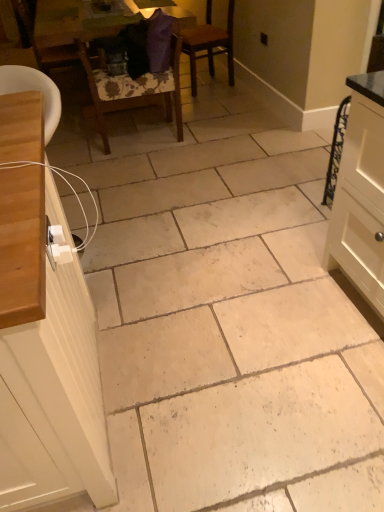
I want to click on free location in front of wooden chair at left, which appears as the 1th chair when viewed from the left, so click(x=78, y=121).